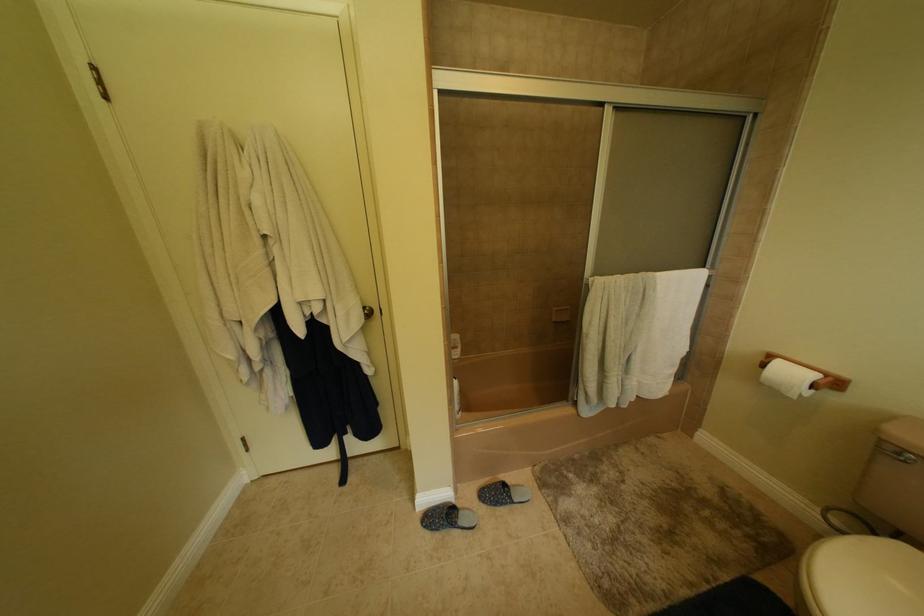
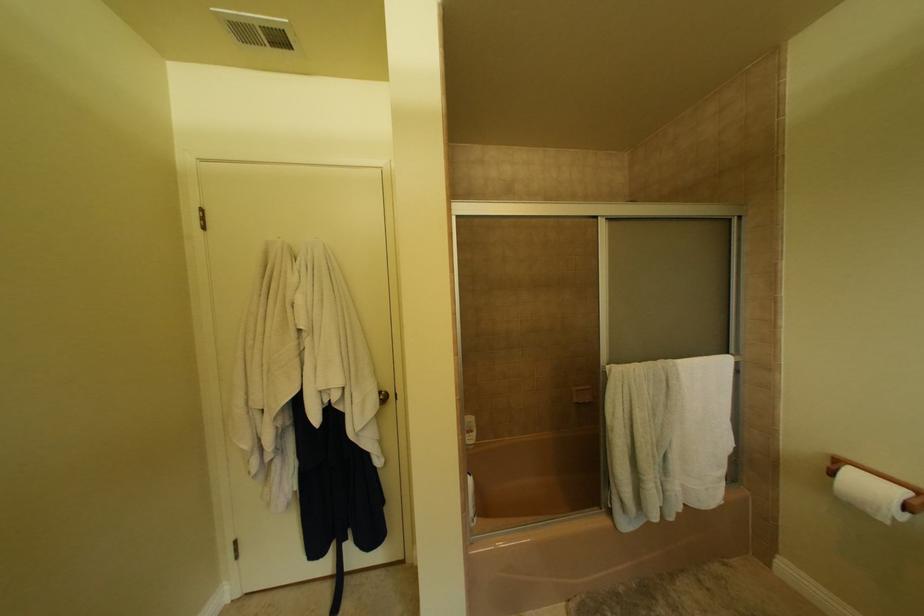
Question: In a continuous first-person perspective shot, in which direction is the camera moving?

Choices:
 (A) Left
 (B) Right
 (C) Forward
 (D) Backward

Answer: (D)